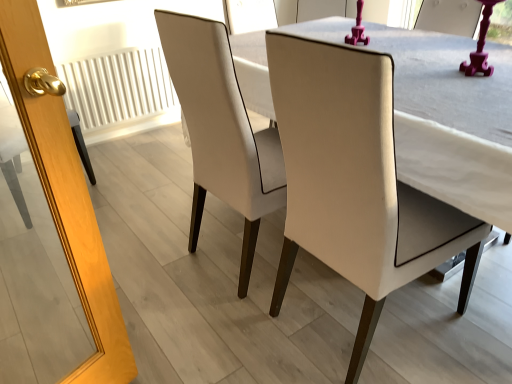
Identify the location of free point above white textured radiator at left (from a real-world perspective). The width and height of the screenshot is (512, 384). (106, 49).